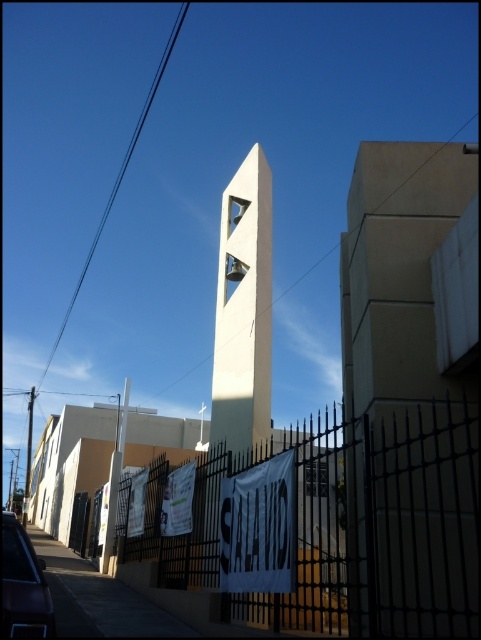
Question: Which of the following is the closest to the observer?

Choices:
 (A) white smooth bell tower at center
 (B) black wrought iron fence at lower center
 (C) black wire at upper left

Answer: (B)

Question: Is black wrought iron fence at lower center bigger than black wire at upper left?

Choices:
 (A) yes
 (B) no

Answer: (B)

Question: Which of these objects is positioned farthest from the black wrought iron fence at lower center?

Choices:
 (A) white smooth bell tower at center
 (B) black wire at upper left

Answer: (B)

Question: Which point is farther to the camera?

Choices:
 (A) white smooth bell tower at center
 (B) black wrought iron fence at lower center
 (C) black wire at upper left

Answer: (C)

Question: From the image, what is the correct spatial relationship of black wrought iron fence at lower center in relation to black wire at upper left?

Choices:
 (A) below
 (B) above

Answer: (A)

Question: Does black wrought iron fence at lower center appear over white smooth bell tower at center?

Choices:
 (A) no
 (B) yes

Answer: (A)